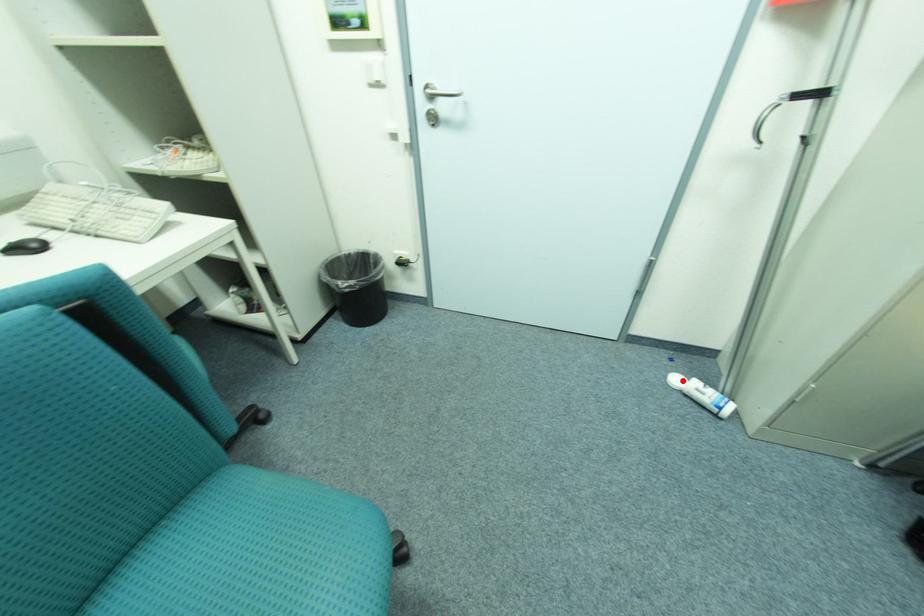
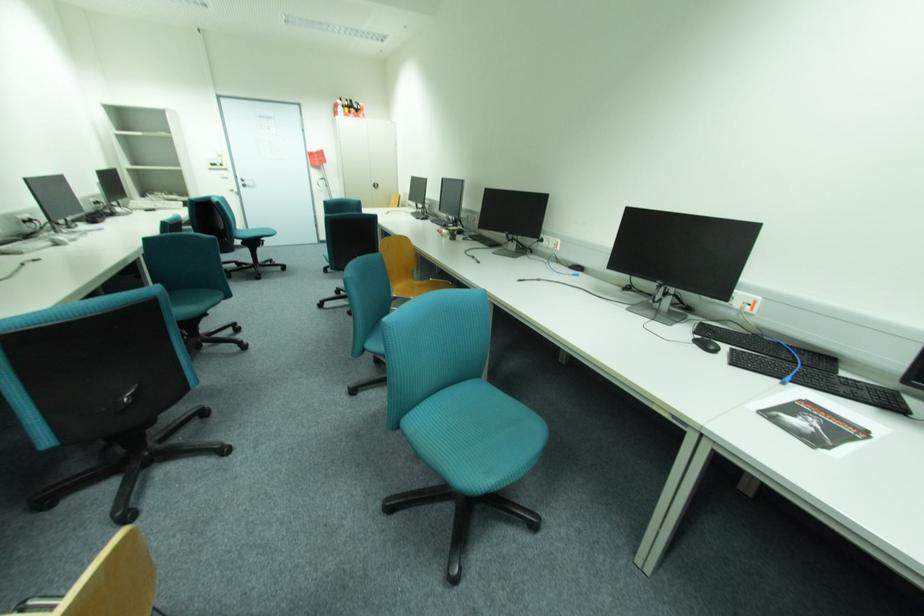
Question: I am providing you with two images of the same scene from different viewpoints. A red point is marked on the first image. Can you still see the location of the red point in image 2?

Choices:
 (A) Yes
 (B) No

Answer: (B)